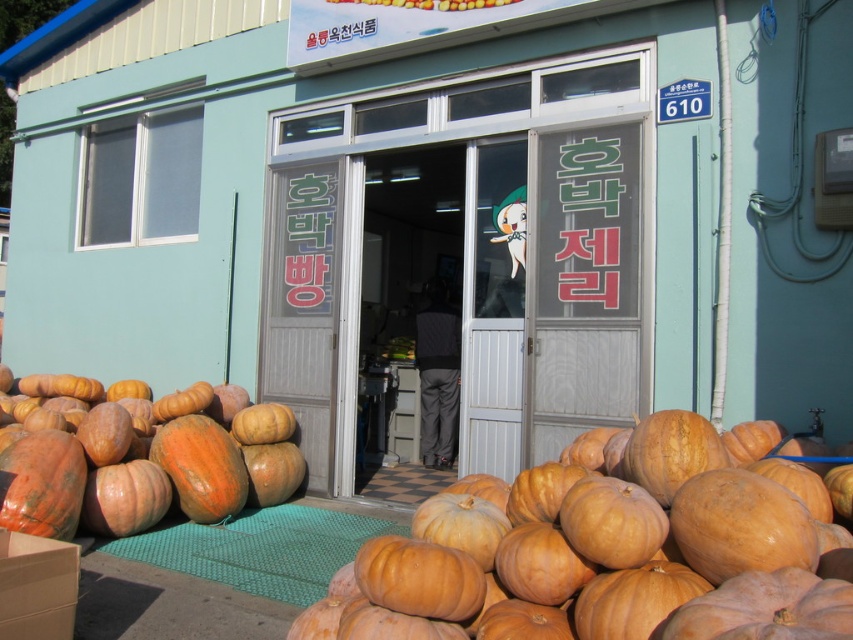
Question: Which is farther from the orange matte pumpkin at center?

Choices:
 (A) orange matte pumpkin at lower center
 (B) smooth glass door at center

Answer: (A)

Question: Which object appears farthest from the camera in this image?

Choices:
 (A) orange matte pumpkin at lower center
 (B) orange matte pumpkin at center
 (C) smooth glass door at center

Answer: (C)

Question: Can you confirm if orange matte pumpkin at lower center is bigger than orange matte pumpkin at center?

Choices:
 (A) no
 (B) yes

Answer: (A)

Question: Does orange matte pumpkin at lower center have a greater width compared to orange matte pumpkin at center?

Choices:
 (A) yes
 (B) no

Answer: (A)

Question: Does smooth glass door at center lie in front of orange matte pumpkin at center?

Choices:
 (A) yes
 (B) no

Answer: (B)

Question: Among these objects, which one is farthest from the camera?

Choices:
 (A) orange matte pumpkin at center
 (B) orange matte pumpkin at lower center

Answer: (A)